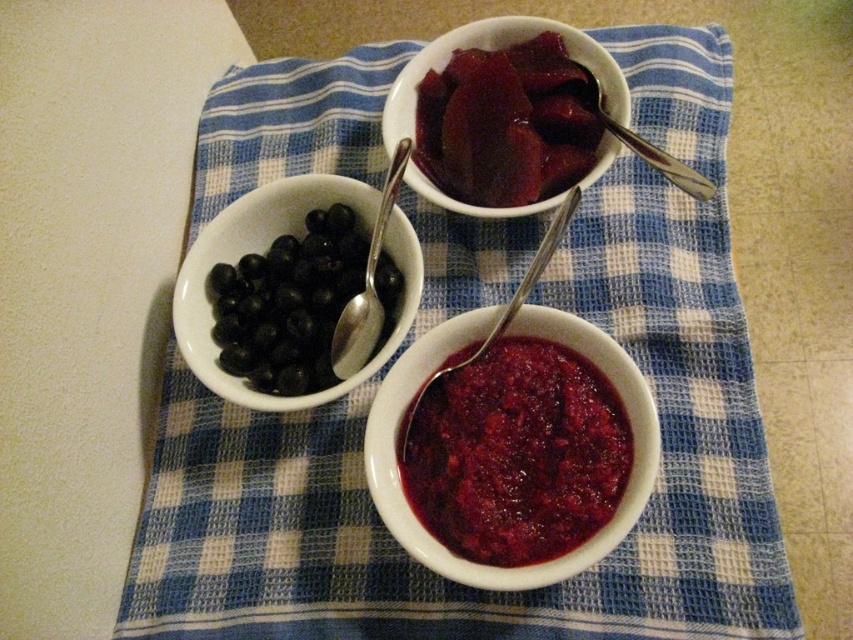
Question: Among these points, which one is farthest from the camera?

Choices:
 (A) (712, 189)
 (B) (538, 252)
 (C) (397, 129)
 (D) (361, 330)

Answer: (B)

Question: Observing the image, what is the correct spatial positioning of matte ceramic bowl at center in reference to black matte blueberries at left?

Choices:
 (A) above
 (B) below

Answer: (B)

Question: Does matte ceramic bowl at center have a lesser width compared to matte ceramic bowl at upper center?

Choices:
 (A) yes
 (B) no

Answer: (A)

Question: Among these points, which one is nearest to the camera?

Choices:
 (A) (657, 156)
 (B) (355, 307)
 (C) (498, 19)

Answer: (A)

Question: Is the position of black matte blueberries at left more distant than that of satin silver spoon at upper left?

Choices:
 (A) yes
 (B) no

Answer: (A)

Question: Which object is the closest to the silver metallic spoon at upper right?

Choices:
 (A) satin silver spoon at upper left
 (B) black matte blueberries at left

Answer: (A)